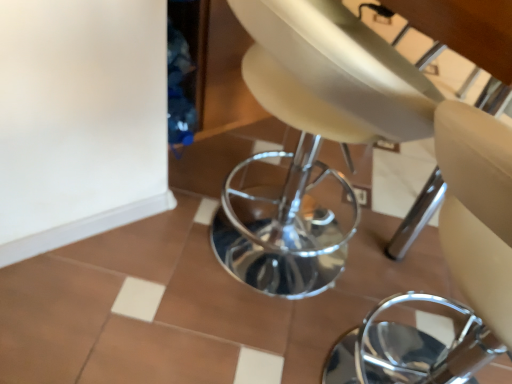
Where is `vacant space underneath beige leather swivel chair at center (from a real-world perspective)`? vacant space underneath beige leather swivel chair at center (from a real-world perspective) is located at coordinates (265, 264).